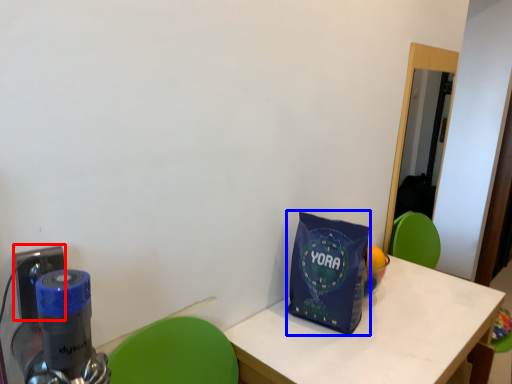
Question: Among these objects, which one is farthest to the camera, electric outlet (highlighted by a red box) or tote bag (highlighted by a blue box)?

Choices:
 (A) electric outlet
 (B) tote bag

Answer: (B)